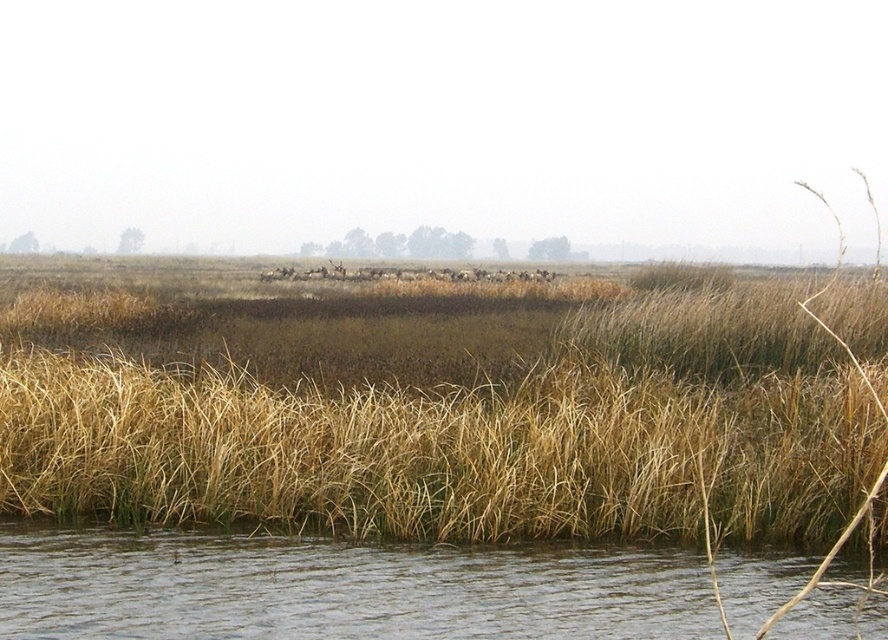
Question: Which object is farther from the camera taking this photo?

Choices:
 (A) clear water at lower center
 (B) dry grass at center
 (C) brown fuzzy deer at center

Answer: (C)

Question: Is clear water at lower center above brown fuzzy deer at center?

Choices:
 (A) no
 (B) yes

Answer: (A)

Question: Is clear water at lower center to the right of brown fuzzy deer at center from the viewer's perspective?

Choices:
 (A) no
 (B) yes

Answer: (B)

Question: Which object is closer to the camera taking this photo?

Choices:
 (A) dry grass at center
 (B) clear water at lower center
 (C) brown fuzzy deer at center

Answer: (B)

Question: Is dry grass at center below clear water at lower center?

Choices:
 (A) yes
 (B) no

Answer: (B)

Question: Which object is farther from the camera taking this photo?

Choices:
 (A) brown fuzzy deer at center
 (B) clear water at lower center
 (C) dry grass at center

Answer: (A)